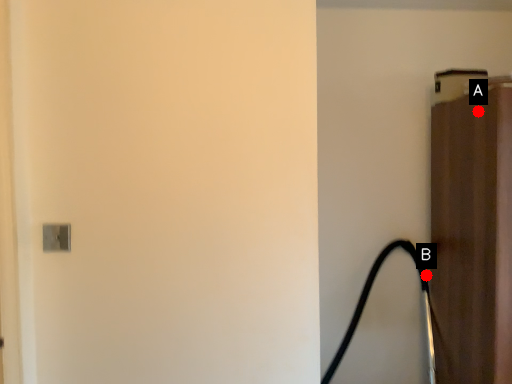
Question: Two points are circled on the image, labeled by A and B beside each circle. Which point is closer to the camera?

Choices:
 (A) A is closer
 (B) B is closer

Answer: (A)